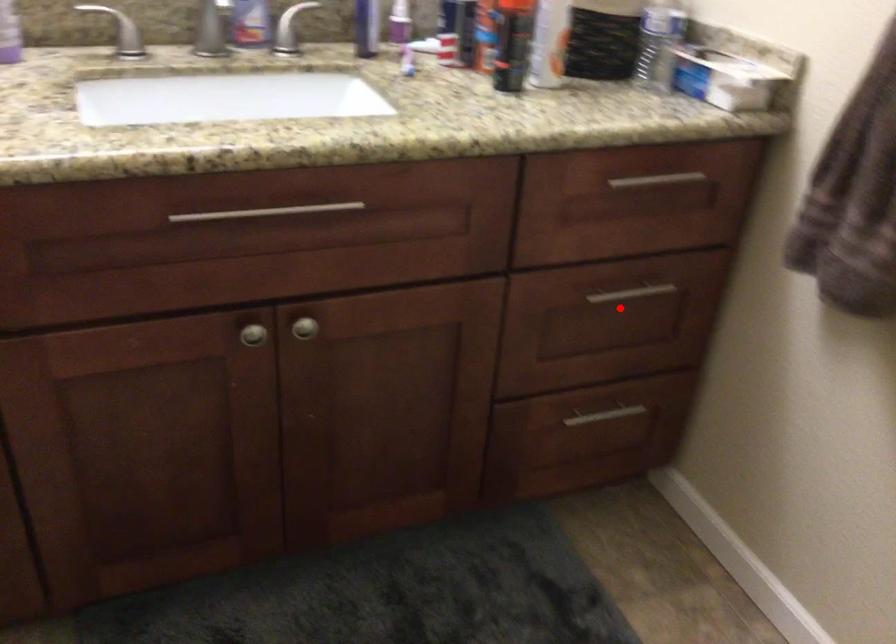
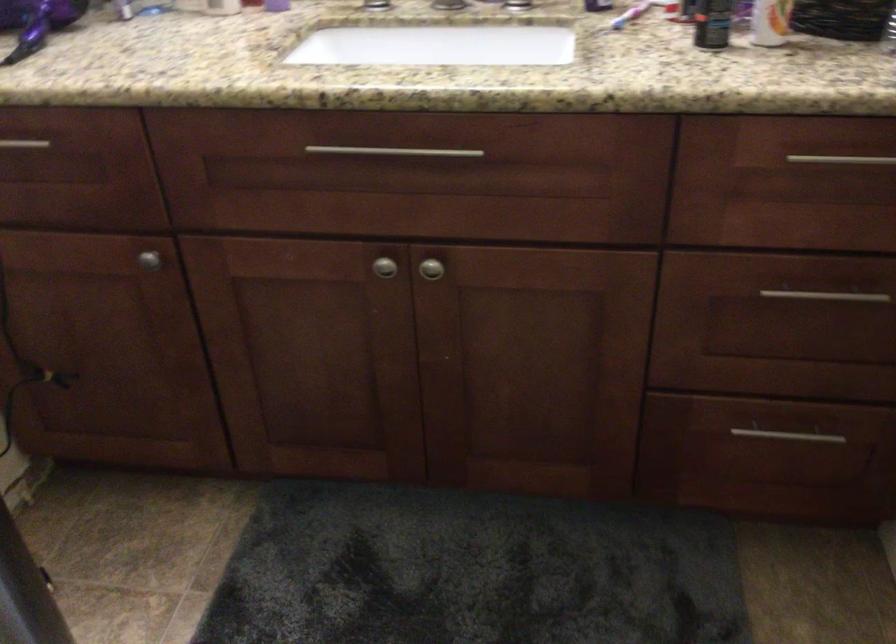
Question: I am providing you with two images of the same scene from different viewpoints. A red point is marked on the first image. At the location where the point appears in image 1, is it still visible in image 2?

Choices:
 (A) Yes
 (B) No

Answer: (A)